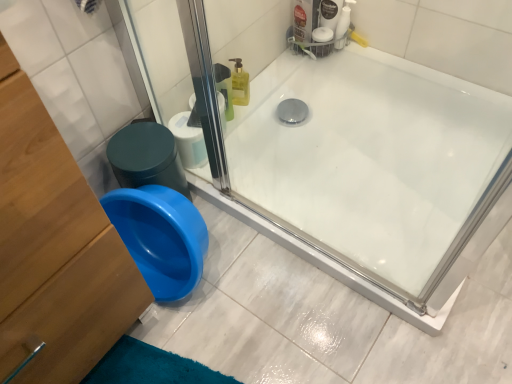
Question: Does wooden dresser at lower left appear on the right side of white glossy bathtub at center?

Choices:
 (A) yes
 (B) no

Answer: (B)

Question: Is the depth of wooden dresser at lower left greater than that of white glossy bathtub at center?

Choices:
 (A) no
 (B) yes

Answer: (A)

Question: Is wooden dresser at lower left outside of white glossy bathtub at center?

Choices:
 (A) yes
 (B) no

Answer: (A)

Question: From the image's perspective, is wooden dresser at lower left below white glossy bathtub at center?

Choices:
 (A) no
 (B) yes

Answer: (B)

Question: From a real-world perspective, is wooden dresser at lower left positioned over white glossy bathtub at center based on gravity?

Choices:
 (A) yes
 (B) no

Answer: (A)

Question: Are wooden dresser at lower left and white glossy bathtub at center located far from each other?

Choices:
 (A) yes
 (B) no

Answer: (B)

Question: Does white glossy bathtub at center come behind wooden dresser at lower left?

Choices:
 (A) no
 (B) yes

Answer: (B)

Question: Is white glossy bathtub at center positioned far away from wooden dresser at lower left?

Choices:
 (A) yes
 (B) no

Answer: (B)

Question: Does white glossy bathtub at center have a greater width compared to wooden dresser at lower left?

Choices:
 (A) yes
 (B) no

Answer: (A)

Question: From the image's perspective, does white glossy bathtub at center appear lower than wooden dresser at lower left?

Choices:
 (A) no
 (B) yes

Answer: (A)

Question: Can you confirm if white glossy bathtub at center is shorter than wooden dresser at lower left?

Choices:
 (A) yes
 (B) no

Answer: (A)

Question: Can you confirm if white glossy bathtub at center is smaller than wooden dresser at lower left?

Choices:
 (A) no
 (B) yes

Answer: (B)

Question: Is white matte toilet paper at center in contact with white glossy bathtub at center?

Choices:
 (A) no
 (B) yes

Answer: (A)